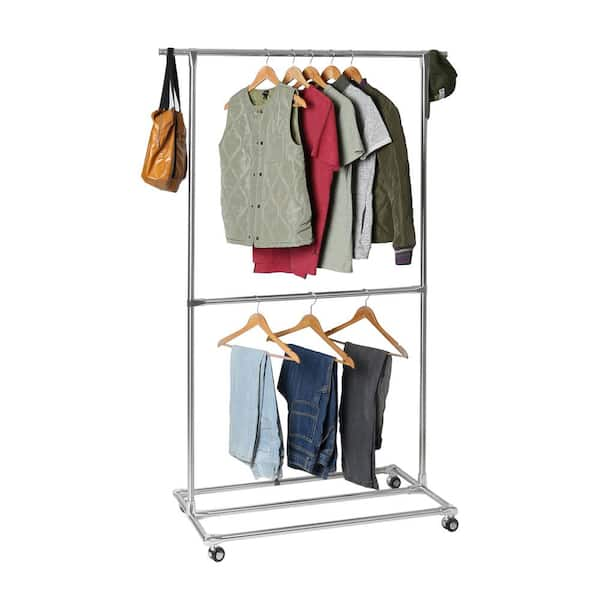
Find the location of a particular element. The image size is (600, 600). metal hanging part of hangers is located at coordinates (268, 55), (295, 51), (312, 53), (334, 54), (351, 54), (368, 294), (313, 301), (259, 307).